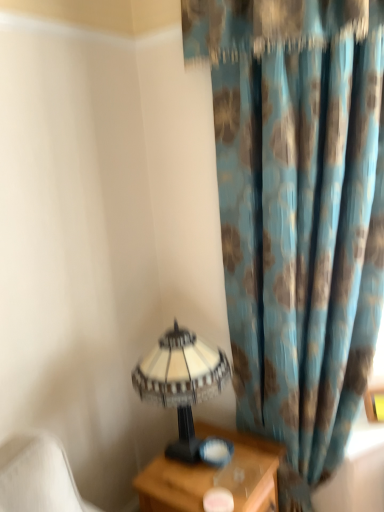
Question: Is the surface of yellow matte picture frame at right in direct contact with wooden nightstand at lower right?

Choices:
 (A) no
 (B) yes

Answer: (A)

Question: Is wooden nightstand at lower right inside yellow matte picture frame at right?

Choices:
 (A) no
 (B) yes

Answer: (A)

Question: Can you confirm if yellow matte picture frame at right is positioned to the right of wooden nightstand at lower right?

Choices:
 (A) no
 (B) yes

Answer: (B)

Question: From a real-world perspective, is yellow matte picture frame at right under wooden nightstand at lower right?

Choices:
 (A) yes
 (B) no

Answer: (B)

Question: Can you confirm if yellow matte picture frame at right is shorter than wooden nightstand at lower right?

Choices:
 (A) no
 (B) yes

Answer: (B)

Question: Is point (200, 503) positioned closer to the camera than point (367, 410)?

Choices:
 (A) closer
 (B) farther

Answer: (A)

Question: Considering the positions of wooden nightstand at lower right and yellow matte picture frame at right in the image, is wooden nightstand at lower right wider or thinner than yellow matte picture frame at right?

Choices:
 (A) thin
 (B) wide

Answer: (B)

Question: Visually, is wooden nightstand at lower right positioned to the left or to the right of yellow matte picture frame at right?

Choices:
 (A) right
 (B) left

Answer: (B)

Question: From a real-world perspective, is wooden nightstand at lower right positioned above or below yellow matte picture frame at right?

Choices:
 (A) below
 (B) above

Answer: (A)

Question: Considering the positions of yellow matte picture frame at right and white textured lampshade at lower left in the image, is yellow matte picture frame at right taller or shorter than white textured lampshade at lower left?

Choices:
 (A) tall
 (B) short

Answer: (B)

Question: From a real-world perspective, relative to white textured lampshade at lower left, is yellow matte picture frame at right vertically above or below?

Choices:
 (A) below
 (B) above

Answer: (A)

Question: Based on their sizes in the image, would you say yellow matte picture frame at right is bigger or smaller than white textured lampshade at lower left?

Choices:
 (A) big
 (B) small

Answer: (B)

Question: Considering their positions, is yellow matte picture frame at right located in front of or behind white textured lampshade at lower left?

Choices:
 (A) front
 (B) behind

Answer: (B)

Question: Is point (311, 116) positioned closer to the camera than point (178, 501)?

Choices:
 (A) closer
 (B) farther

Answer: (B)

Question: Considering their positions, is blue floral fabric curtain at right located in front of or behind wooden nightstand at lower right?

Choices:
 (A) front
 (B) behind

Answer: (A)